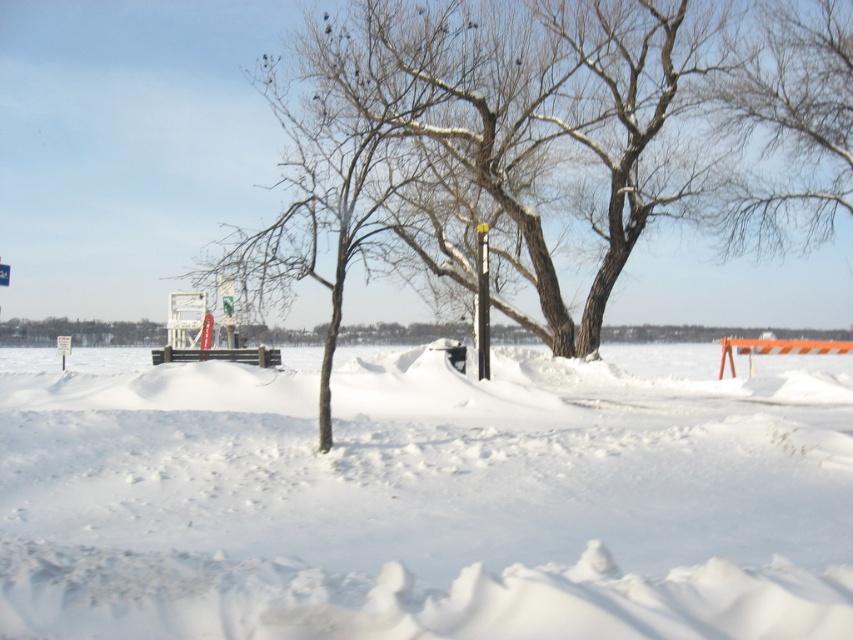
You are a hiker trying to cross a snowy area. You see the white fluffy snow at center and the black plastic pole at center. Which one is higher in height?

The white fluffy snow at center is much taller than the black plastic pole at center.

You are standing at the origin point of the coordinate system in the winter scene. You want to walk to the white fluffy snow at center. Which direction should you move in to reach it?

The white fluffy snow at center is located at point (425,497), so you should move towards the right and slightly forward to reach it.